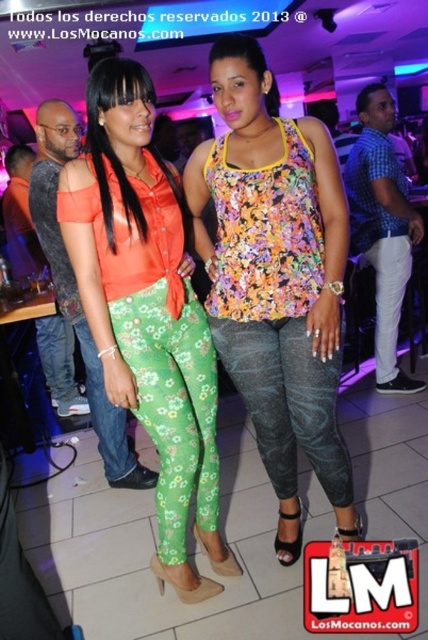
Consider the image. Does metallic textured leggings at center have a lesser height compared to white cotton pants at right?

Correct, metallic textured leggings at center is not as tall as white cotton pants at right.

Which is more to the left, metallic textured leggings at center or white cotton pants at right?

A: Positioned to the left is metallic textured leggings at center.

Image resolution: width=428 pixels, height=640 pixels. What are the coordinates of `metallic textured leggings at center` in the screenshot? It's located at [x=288, y=401].

Identify the location of metallic textured leggings at center. This screenshot has height=640, width=428. (288, 401).

Does white cotton pants at right have a lesser height compared to green floral leggings at lower left?

No.

Between white cotton pants at right and green floral leggings at lower left, which one has less height?

green floral leggings at lower left

Is point (385, 368) in front of point (136, 456)?

No, (385, 368) is behind (136, 456).

The image size is (428, 640). Identify the location of white cotton pants at right. (389, 298).

Does point (249, 269) come farther from viewer compared to point (160, 515)?

No, (249, 269) is in front of (160, 515).

Is point (329, 483) in front of point (121, 280)?

No, (329, 483) is behind (121, 280).

At what (x,y) coordinates should I click in order to perform the action: click on floral fabric top at center. Please return your answer as a coordinate pair (x, y). This screenshot has height=640, width=428. Looking at the image, I should click on click(x=276, y=278).